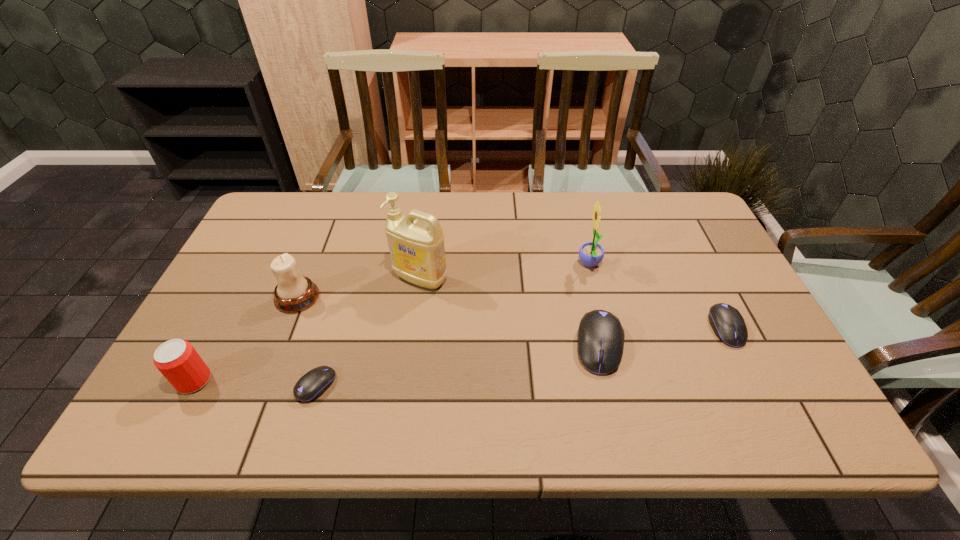
Image resolution: width=960 pixels, height=540 pixels. I want to click on vacant space located on the left of the fourth object from right to left, so click(x=343, y=279).

You are a GUI agent. You are given a task and a screenshot of the screen. Output one action in this format:
    pyautogui.click(x=<x>, y=<y>)
    Task: Click on the free space located on the back of the beer can
    
    Given the screenshot: What is the action you would take?
    pyautogui.click(x=260, y=254)

Find the location of a particular element. The image size is (960, 540). beer can that is at the near edge is located at coordinates (177, 360).

You are a GUI agent. You are given a task and a screenshot of the screen. Output one action in this format:
    pyautogui.click(x=<x>, y=<y>)
    Task: Click on the candle holder positioned at the left edge
    This screenshot has width=960, height=540.
    Given the screenshot: What is the action you would take?
    pyautogui.click(x=294, y=292)

Identify the location of beer can that is positioned at the left edge. This screenshot has height=540, width=960. (177, 360).

This screenshot has width=960, height=540. Find the location of `object present at the right edge`. object present at the right edge is located at coordinates (729, 326).

You are a GUI agent. You are given a task and a screenshot of the screen. Output one action in this format:
    pyautogui.click(x=<x>, y=<y>)
    Task: Click on the object situated at the near left corner
    The height and width of the screenshot is (540, 960).
    Given the screenshot: What is the action you would take?
    [x=177, y=360]

The image size is (960, 540). What are the coordinates of `vacant space at the far edge of the desktop` in the screenshot? It's located at (606, 209).

In the image, there is a desktop. Where is `vacant space at the near edge`? vacant space at the near edge is located at coordinates (517, 384).

This screenshot has height=540, width=960. What are the coordinates of `vacant area at the left edge of the desktop` in the screenshot? It's located at (239, 331).